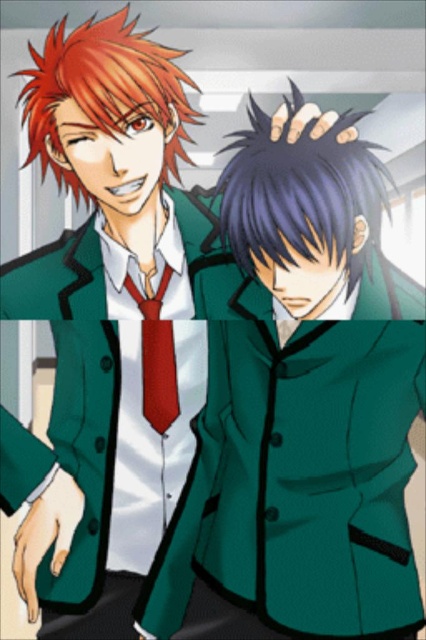
Question: From the image, what is the correct spatial relationship of green woolen blazer at center in relation to matte red tie at center?

Choices:
 (A) right
 (B) left

Answer: (A)

Question: Is green woolen blazer at center thinner than matte red tie at center?

Choices:
 (A) no
 (B) yes

Answer: (A)

Question: Is green woolen blazer at center wider than matte red tie at center?

Choices:
 (A) yes
 (B) no

Answer: (A)

Question: Which of the following is the closest to the observer?

Choices:
 (A) (164, 273)
 (B) (325, 556)

Answer: (B)

Question: Which object appears closest to the camera in this image?

Choices:
 (A) green woolen blazer at center
 (B) matte red tie at center

Answer: (A)